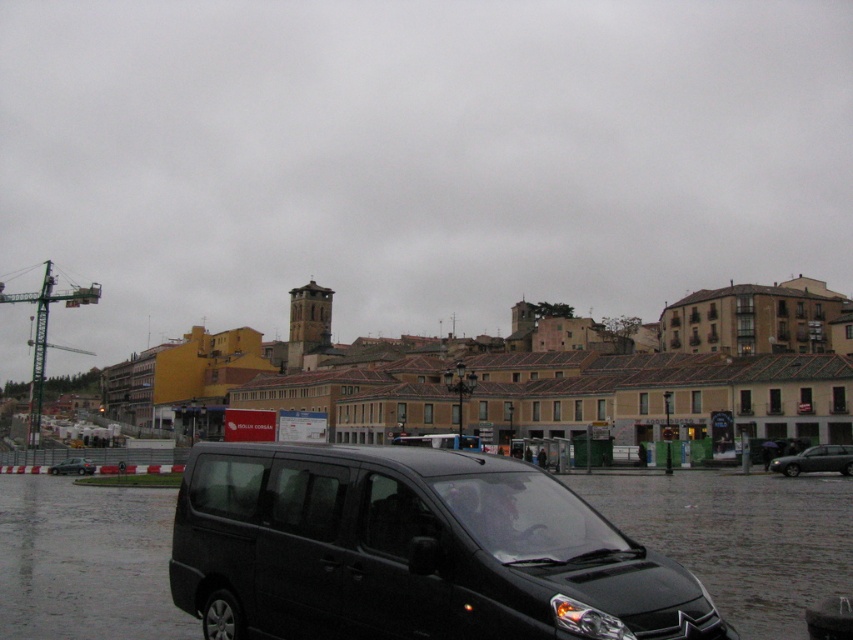
Is point (250, 445) positioned behind point (79, 458)?

No, (250, 445) is in front of (79, 458).

Which of these two, black matte van at lower left or metallic silver hatchback at lower left, stands shorter?

metallic silver hatchback at lower left is shorter.

Where is `black matte van at lower left`? The width and height of the screenshot is (853, 640). black matte van at lower left is located at coordinates (410, 550).

At what (x,y) coordinates should I click in order to perform the action: click on black matte van at lower left. Please return your answer as a coordinate pair (x, y). Looking at the image, I should click on tap(410, 550).

Which is behind, point (90, 289) or point (80, 465)?

The point (90, 289) is behind.

Does green metallic crane at left appear over metallic silver hatchback at lower left?

Indeed, green metallic crane at left is positioned over metallic silver hatchback at lower left.

Where is `green metallic crane at left`? This screenshot has width=853, height=640. green metallic crane at left is located at coordinates (45, 336).

Which is above, dark gray metallic car at right or black matte van at center?

dark gray metallic car at right is higher up.

Between point (836, 460) and point (425, 444), which one is positioned behind?

The point (425, 444) is more distant.

Find the location of a particular element. dark gray metallic car at right is located at coordinates (815, 460).